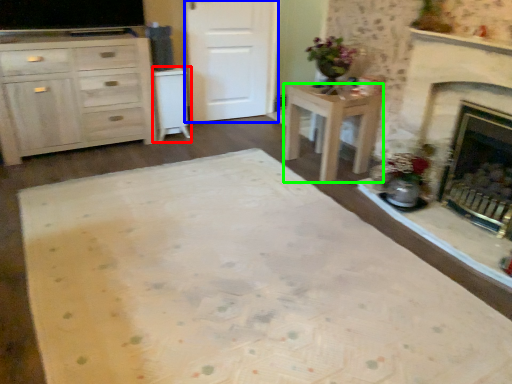
Question: Estimate the real-world distances between objects in this image. Which object is closer to cabinetry (highlighted by a red box), door (highlighted by a blue box) or desk (highlighted by a green box)?

Choices:
 (A) door
 (B) desk

Answer: (A)